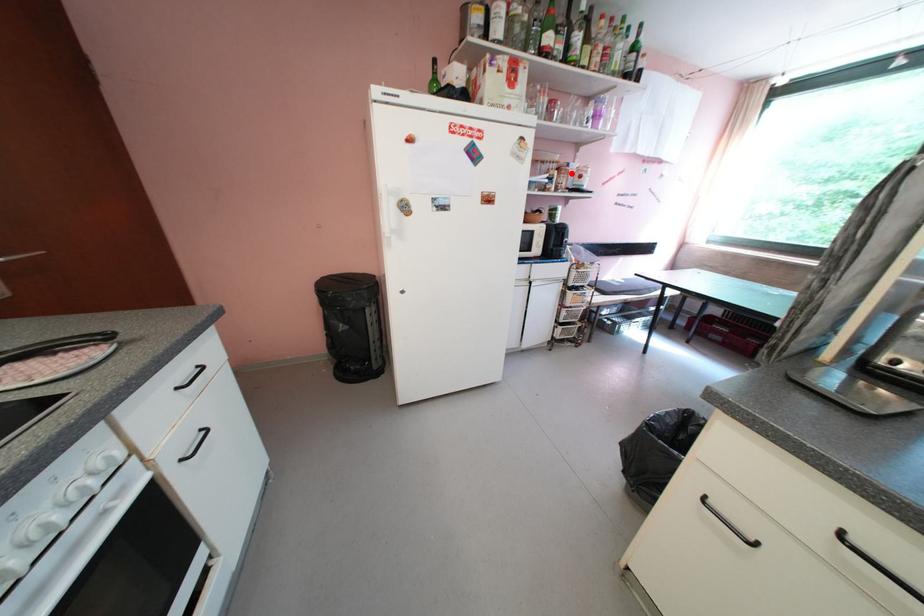
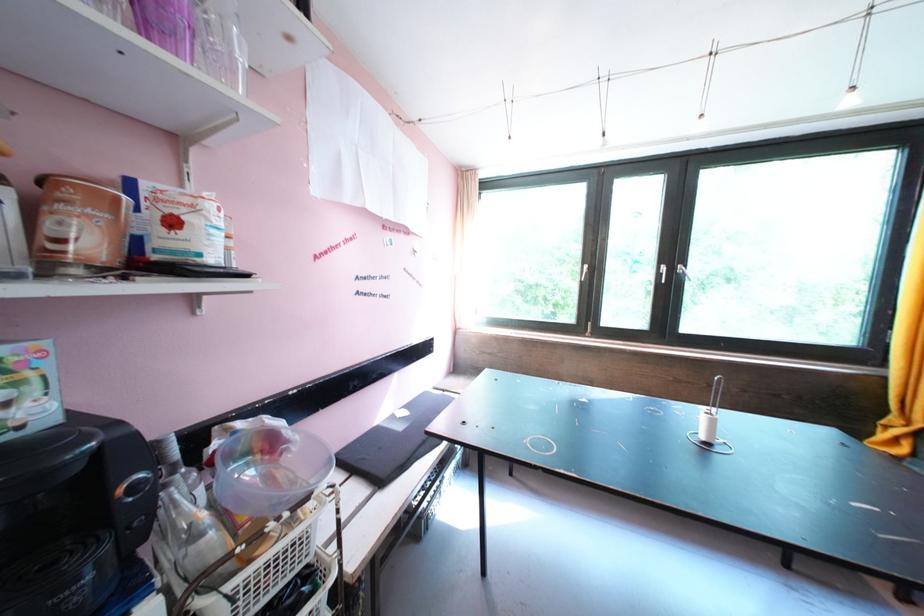
Question: I am providing you with two images of the same scene from different viewpoints. Image1 has a red point marked. In image2, the corresponding 3D location appears at what relative position? Reply with the corresponding letter.

Choices:
 (A) Closer
 (B) Farther

Answer: (B)